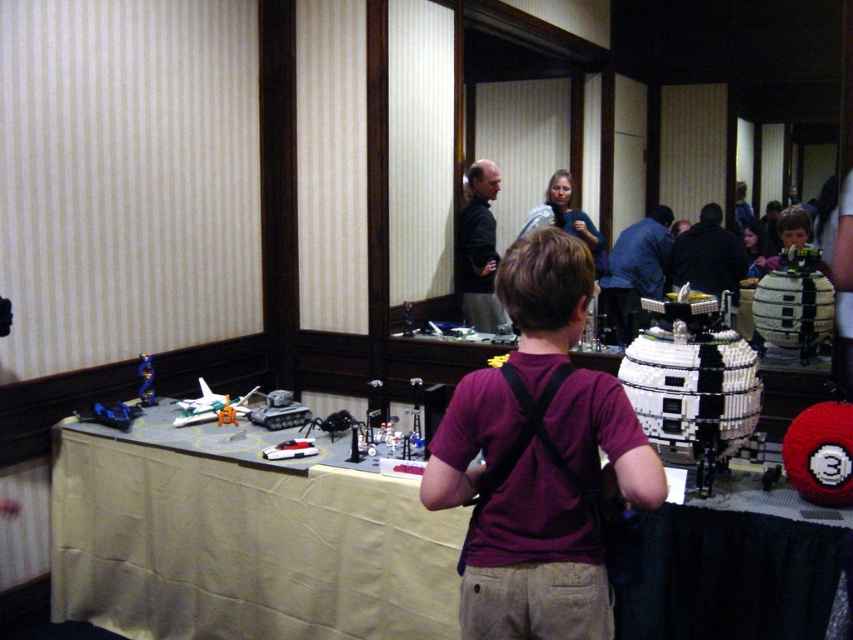
Who is taller, maroon t-shirt at center or dark gray shirt at center?

With more height is dark gray shirt at center.

Image resolution: width=853 pixels, height=640 pixels. What are the coordinates of `maroon t-shirt at center` in the screenshot? It's located at (532, 557).

Is point (491, 541) in front of point (471, 195)?

Yes, point (491, 541) is in front of point (471, 195).

The width and height of the screenshot is (853, 640). Find the location of `maroon t-shirt at center`. maroon t-shirt at center is located at coordinates (532, 557).

Which is behind, point (252, 625) or point (601, 577)?

The point (252, 625) is more distant.

Between white fabric table at center and maroon t-shirt at center, which one is positioned higher?

maroon t-shirt at center

Is point (53, 548) closer to camera compared to point (502, 540)?

No, (53, 548) is behind (502, 540).

Find the location of a particular element. Image resolution: width=853 pixels, height=640 pixels. white fabric table at center is located at coordinates (241, 541).

Who is higher up, white fabric table at center or dark blue shirt at center?

dark blue shirt at center is above.

Is white fabric table at center wider than dark blue shirt at center?

Yes, white fabric table at center is wider than dark blue shirt at center.

The image size is (853, 640). Find the location of `white fabric table at center`. white fabric table at center is located at coordinates (241, 541).